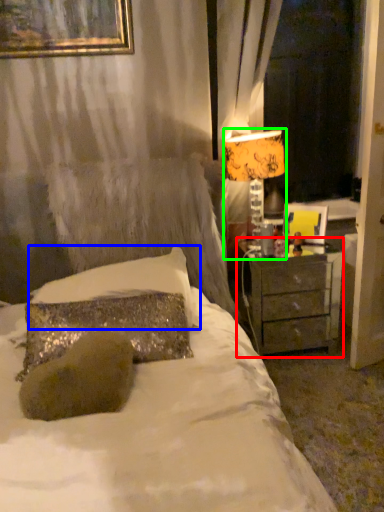
Question: Which object is positioned farthest from nightstand (highlighted by a red box)? Select from pillow (highlighted by a blue box) and table lamp (highlighted by a green box).

Choices:
 (A) pillow
 (B) table lamp

Answer: (A)